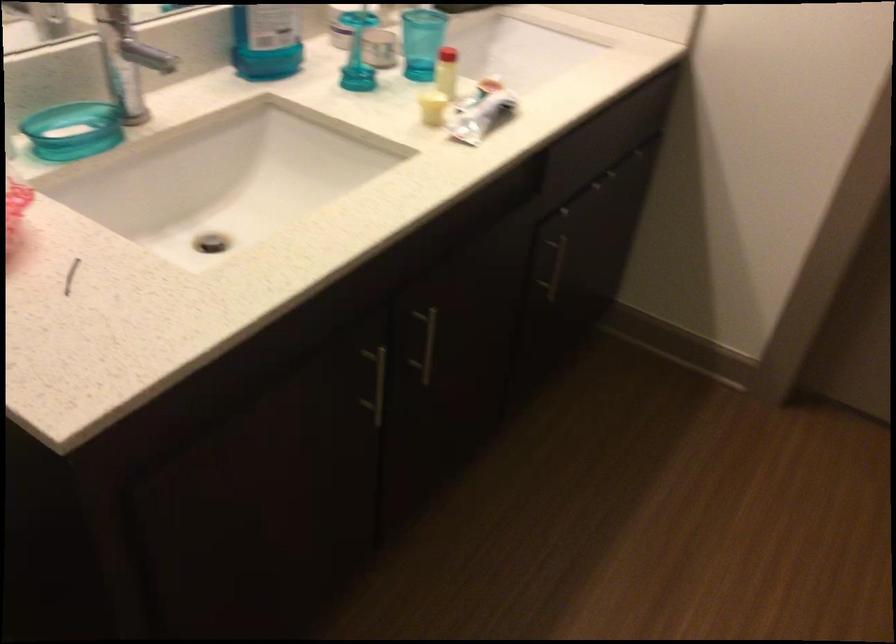
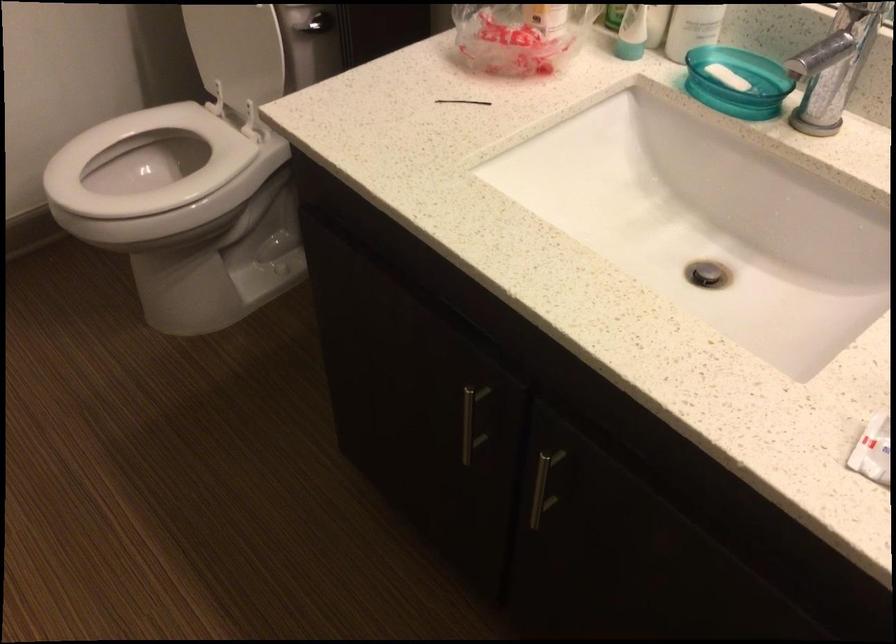
The point at (202, 252) is marked in the first image. Where is the corresponding point in the second image?

(707, 274)